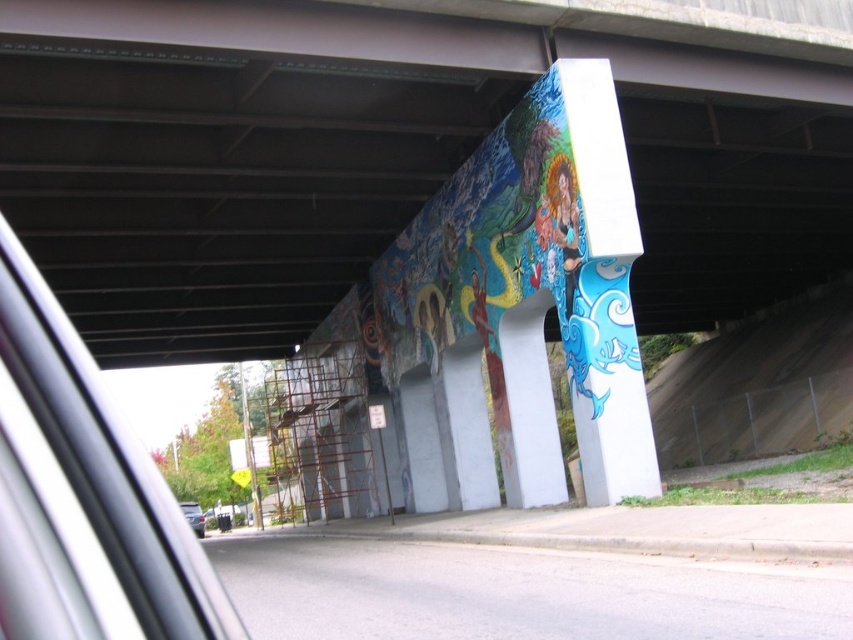
You are driving a car that is 1.8 meters wide. You see the painted mural at center and the metallic silver car at lower left on the road. Can your car fit between the two objects without touching them?

The painted mural at center is wider than the metallic silver car at lower left. Since the car is 1.8 meters wide, and the distance between the two objects is not specified, it is unclear if there is enough space. However, since the mural is wider, it might indicate that there is sufficient space for the car to pass through safely.

You are standing at the base of the bridge looking up at the pillars with murals. There are two points marked on one of the pillars. The first point is at coordinates point (506, 348) and the second is at point (190, 506). Which point is closer to your eyes?

Point (506, 348) is closer to the camera than point (190, 506), so the first point is closer to your eyes.